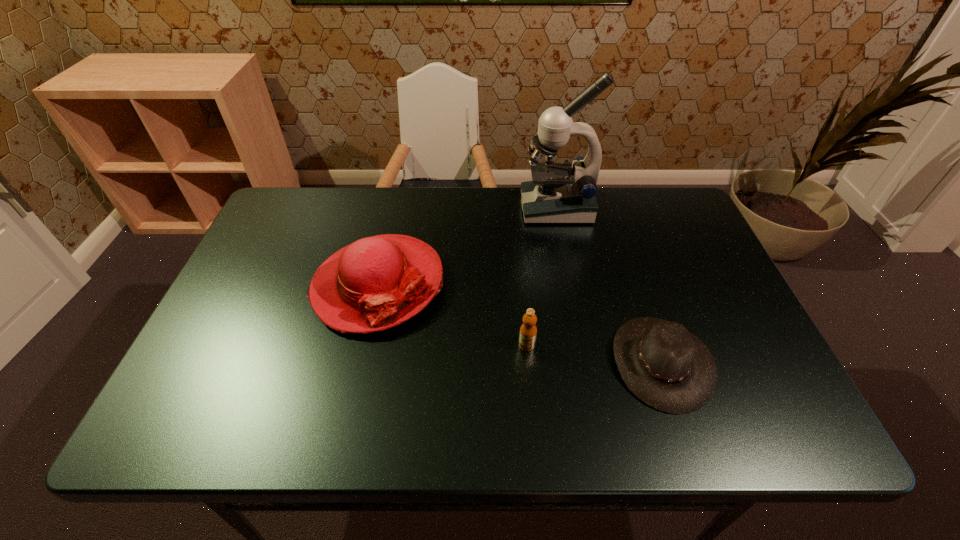
Identify the location of free space between the farthest object and the orange juice. This screenshot has height=540, width=960. (541, 276).

Identify the location of vacant area that lies between the second object from left to right and the leftmost object. Image resolution: width=960 pixels, height=540 pixels. (x=452, y=315).

I want to click on free space between the right hat and the taller hat, so click(x=519, y=323).

Point out which object is positioned as the second nearest to the right hat. Please provide its 2D coordinates. Your answer should be formatted as a tuple, i.e. [(x, y)], where the tuple contains the x and y coordinates of a point satisfying the conditions above.

[(559, 193)]

The height and width of the screenshot is (540, 960). I want to click on object that is the third closest to the right hat, so click(375, 283).